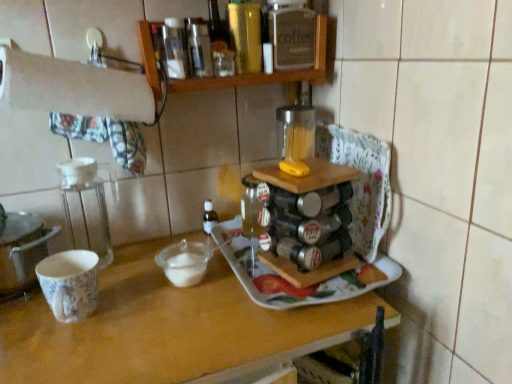
Locate an element on the screen. The image size is (512, 384). vacant area that lies between porcelain floral mug at left and transparent glass mixing bowl at center is located at coordinates (136, 296).